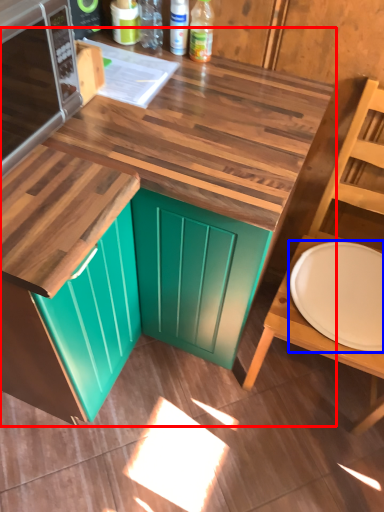
Question: Which object is further to the camera taking this photo, countertop (highlighted by a red box) or plate (highlighted by a blue box)?

Choices:
 (A) countertop
 (B) plate

Answer: (B)